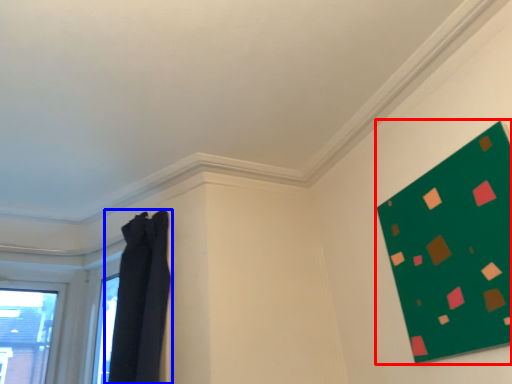
Question: Among these objects, which one is nearest to the camera, bulletin board (highlighted by a red box) or curtain (highlighted by a blue box)?

Choices:
 (A) bulletin board
 (B) curtain

Answer: (A)